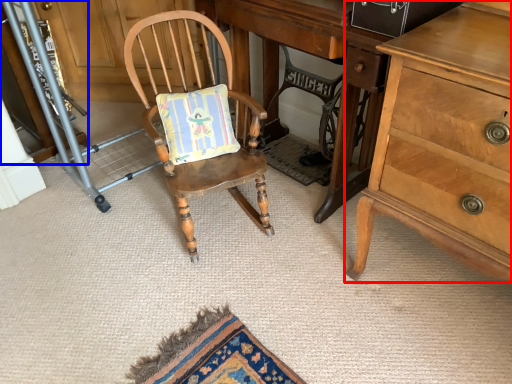
Question: Among these objects, which one is farthest to the camera, chest of drawers (highlighted by a red box) or cabinetry (highlighted by a blue box)?

Choices:
 (A) chest of drawers
 (B) cabinetry

Answer: (B)